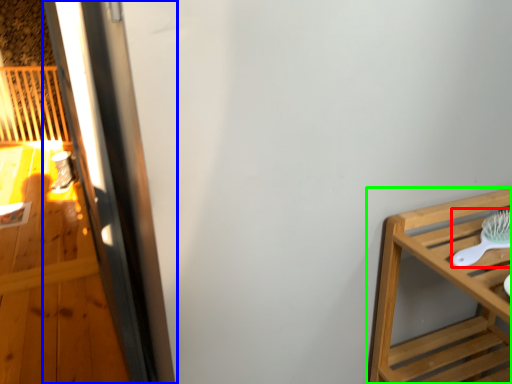
Question: Which is farther away from brush (highlighted by a red box)? screen door (highlighted by a blue box) or furniture (highlighted by a green box)?

Choices:
 (A) screen door
 (B) furniture

Answer: (A)